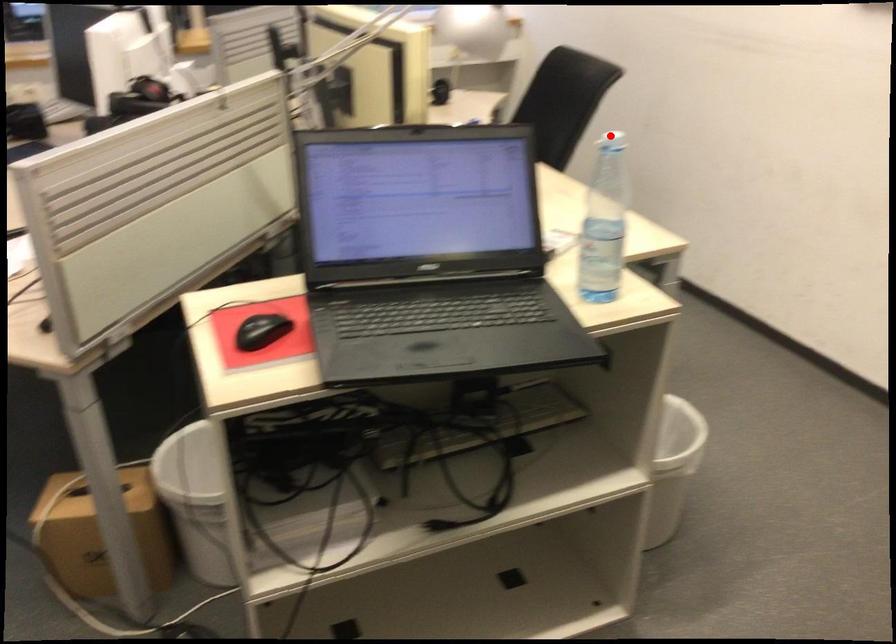
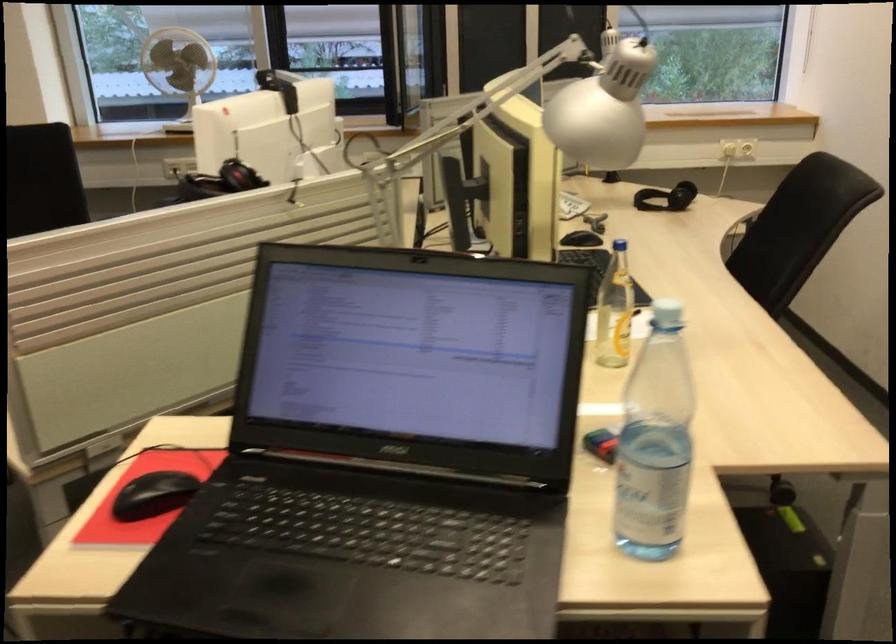
Question: I am providing you with two images of the same scene from different viewpoints. Given a red point in image1, look at the same physical point in image2. Is it:

Choices:
 (A) Closer to the viewpoint
 (B) Farther from the viewpoint

Answer: (A)